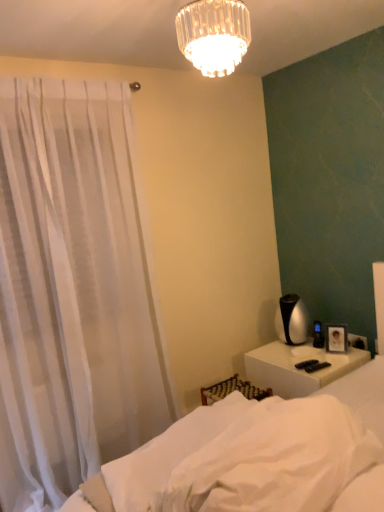
Question: From a real-world perspective, does white soft fabric bed at lower right sit lower than white sheer curtain at left?

Choices:
 (A) no
 (B) yes

Answer: (B)

Question: Does white soft fabric bed at lower right have a lesser height compared to white sheer curtain at left?

Choices:
 (A) no
 (B) yes

Answer: (B)

Question: Considering the relative sizes of white soft fabric bed at lower right and white sheer curtain at left in the image provided, is white soft fabric bed at lower right wider than white sheer curtain at left?

Choices:
 (A) yes
 (B) no

Answer: (A)

Question: From the image's perspective, is white soft fabric bed at lower right located beneath white sheer curtain at left?

Choices:
 (A) yes
 (B) no

Answer: (A)

Question: Is white soft fabric bed at lower right at the right side of white sheer curtain at left?

Choices:
 (A) no
 (B) yes

Answer: (B)

Question: Do you think white soft fabric at lower center, the 1th sheet positioned from the front, is within white sheer curtain at left, or outside of it?

Choices:
 (A) inside
 (B) outside

Answer: (B)

Question: Is white soft fabric at lower center, the second sheet when ordered from back to front, to the left or to the right of white sheer curtain at left in the image?

Choices:
 (A) left
 (B) right

Answer: (B)

Question: From a real-world perspective, is white soft fabric at lower center, the 1th sheet positioned from the front, physically located above or below white sheer curtain at left?

Choices:
 (A) below
 (B) above

Answer: (A)

Question: Relative to white sheer curtain at left, is white soft fabric at lower center, the second sheet when ordered from back to front, in front or behind?

Choices:
 (A) front
 (B) behind

Answer: (A)

Question: From the image's perspective, relative to white glossy nightstand at lower right, is clear glass chandelier at upper center above or below?

Choices:
 (A) below
 (B) above

Answer: (B)

Question: In terms of height, does clear glass chandelier at upper center look taller or shorter compared to white glossy nightstand at lower right?

Choices:
 (A) tall
 (B) short

Answer: (B)

Question: Looking at their shapes, would you say clear glass chandelier at upper center is wider or thinner than white glossy nightstand at lower right?

Choices:
 (A) thin
 (B) wide

Answer: (A)

Question: Is clear glass chandelier at upper center situated inside white glossy nightstand at lower right or outside?

Choices:
 (A) outside
 (B) inside

Answer: (A)

Question: Based on their positions, is white soft fabric at lower center, which is counted as the first sheet, starting from the back, located to the left or right of white soft fabric bed at lower right?

Choices:
 (A) right
 (B) left

Answer: (B)

Question: Looking at their shapes, would you say white soft fabric at lower center, placed as the 2th sheet when sorted from front to back, is wider or thinner than white soft fabric bed at lower right?

Choices:
 (A) thin
 (B) wide

Answer: (A)